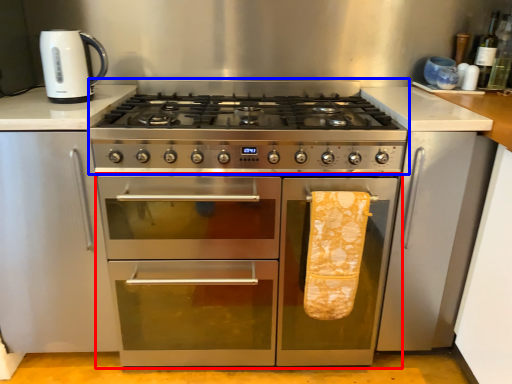
Question: Among these objects, which one is farthest to the camera, oven (highlighted by a red box) or gas stove (highlighted by a blue box)?

Choices:
 (A) oven
 (B) gas stove

Answer: (A)